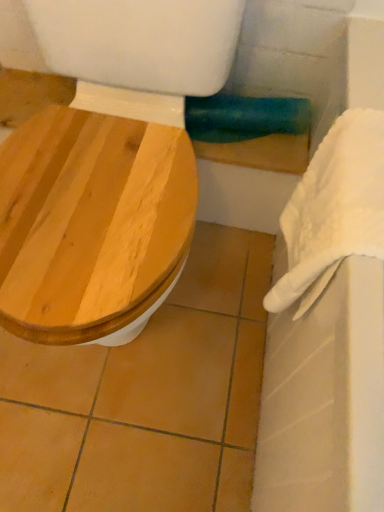
Question: Is wooden toilet seat at left touching white fluffy towel at right?

Choices:
 (A) yes
 (B) no

Answer: (B)

Question: Is wooden toilet seat at left positioned in front of white fluffy towel at right?

Choices:
 (A) yes
 (B) no

Answer: (A)

Question: Does wooden toilet seat at left appear on the left side of white fluffy towel at right?

Choices:
 (A) no
 (B) yes

Answer: (B)

Question: From the image's perspective, would you say wooden toilet seat at left is positioned over white fluffy towel at right?

Choices:
 (A) yes
 (B) no

Answer: (A)

Question: Is white fluffy towel at right a part of wooden toilet seat at left?

Choices:
 (A) yes
 (B) no

Answer: (B)

Question: Can you confirm if wooden toilet seat at left is bigger than white fluffy towel at right?

Choices:
 (A) no
 (B) yes

Answer: (B)

Question: Is there a large distance between wooden toilet seat at left and white fabric towel bar at upper right?

Choices:
 (A) yes
 (B) no

Answer: (B)

Question: Is wooden toilet seat at left placed right next to white fabric towel bar at upper right?

Choices:
 (A) no
 (B) yes

Answer: (A)

Question: Does wooden toilet seat at left turn towards white fabric towel bar at upper right?

Choices:
 (A) no
 (B) yes

Answer: (A)

Question: From a real-world perspective, is wooden toilet seat at left on white fabric towel bar at upper right?

Choices:
 (A) yes
 (B) no

Answer: (A)

Question: Is wooden toilet seat at left outside of white fabric towel bar at upper right?

Choices:
 (A) no
 (B) yes

Answer: (B)

Question: Is wooden toilet seat at left at the right side of white fabric towel bar at upper right?

Choices:
 (A) no
 (B) yes

Answer: (A)

Question: Considering the relative sizes of white fluffy towel at right and wooden toilet seat at left in the image provided, is white fluffy towel at right bigger than wooden toilet seat at left?

Choices:
 (A) yes
 (B) no

Answer: (B)